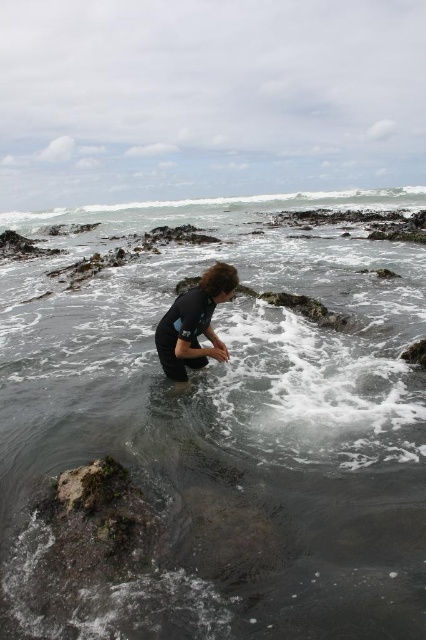
Question: Can you confirm if clear water at center is bigger than dark blue wetsuit at center?

Choices:
 (A) yes
 (B) no

Answer: (A)

Question: Can you confirm if clear water at center is positioned to the right of dark blue wetsuit at center?

Choices:
 (A) yes
 (B) no

Answer: (B)

Question: Which of the following is the farthest from the observer?

Choices:
 (A) (201, 362)
 (B) (115, 358)

Answer: (B)

Question: Which object is closer to the camera taking this photo?

Choices:
 (A) clear water at center
 (B) dark blue wetsuit at center

Answer: (A)

Question: Can you confirm if clear water at center is smaller than dark blue wetsuit at center?

Choices:
 (A) no
 (B) yes

Answer: (A)